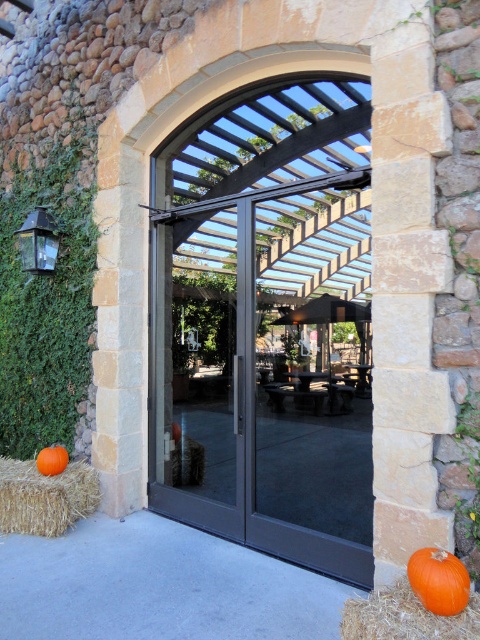
Question: Is the position of orange matte pumpkin at lower right less distant than that of orange matte pumpkin at lower left?

Choices:
 (A) no
 (B) yes

Answer: (B)

Question: Which point is closer to the camera?

Choices:
 (A) orange matte pumpkin at lower right
 (B) orange matte pumpkin at lower left
 (C) straw bale at lower left
 (D) black glass door at center

Answer: (A)

Question: Can you confirm if orange hay at lower right is smaller than orange matte pumpkin at lower left?

Choices:
 (A) yes
 (B) no

Answer: (B)

Question: Which of these objects is positioned farthest from the orange hay at lower right?

Choices:
 (A) orange matte pumpkin at lower left
 (B) black glass door at center
 (C) straw bale at lower left

Answer: (B)

Question: Does orange matte pumpkin at lower right have a larger size compared to orange matte pumpkin at lower left?

Choices:
 (A) no
 (B) yes

Answer: (A)

Question: Which point is closer to the camera taking this photo?

Choices:
 (A) (37, 468)
 (B) (444, 604)
 (C) (409, 589)

Answer: (B)